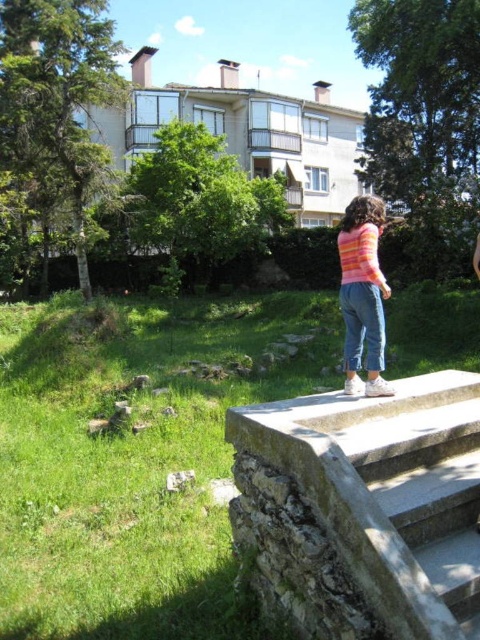
You are a delivery person carrying a package that is 2 feet wide. You need to walk up the stone stairs at center while avoiding stepping on the pink striped sweater at center. Can you safely carry the package up the stairs without the sweater getting in the way?

The stone stairs at center might be wider than the pink striped sweater at center, so there is a possibility that the delivery person can safely navigate the stairs while avoiding the sweater. However, since the exact width difference isn not specified, caution is advised to ensure the package doesnnt collide with the sweater.

You are a photographer trying to capture the pink striped sweater at center and the stone stairs at center in the same frame. Based on their positions, which object should you focus on first to ensure both are in the shot?

The stone stairs at center is in front of the pink striped sweater at center, so you should focus on the pink striped sweater at center first to ensure both are in the shot.

You are a parent trying to ensure your child can safely climb the stone stairs at center while wearing the pink striped sweater at center. Based on the height difference between them, can the child climb the stairs without the sweater getting in the way?

The stone stairs at center has a lesser height compared to the pink striped sweater at center, meaning the stairs are shorter than the sweater. Since the stairs are shorter than the sweater, the sweater might drag or get caught when climbing, so the child may need to adjust their position to avoid the sweater getting in the way.